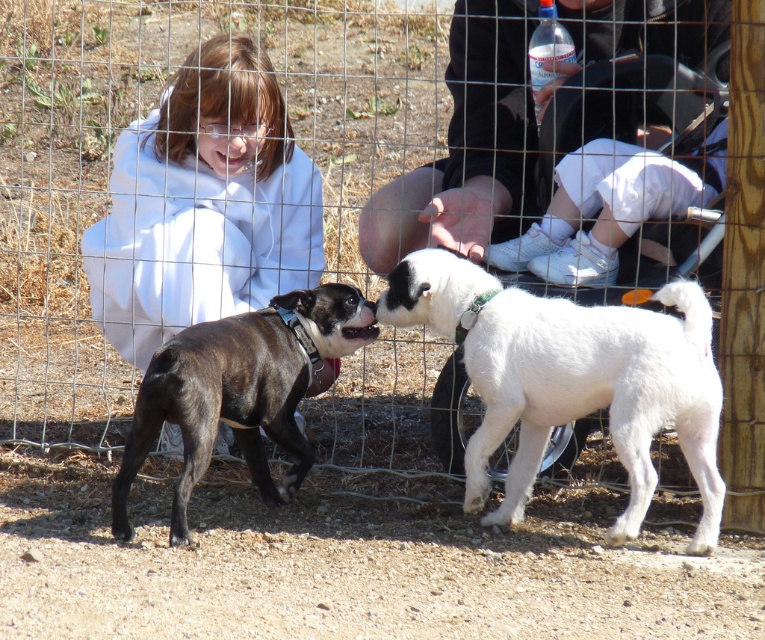
Is point (560, 109) positioned in front of point (106, 241)?

Yes, point (560, 109) is closer to viewer.

Which of these two, black fabric pants at lower center or white clothed child at left, stands shorter?

Standing shorter between the two is black fabric pants at lower center.

Is point (624, 221) positioned behind point (259, 106)?

No.

In order to click on black fabric pants at lower center in this screenshot , I will do `click(557, 141)`.

Which is more to the right, white clothed child at left or white fluffy dog at center?

white fluffy dog at center is more to the right.

Can you confirm if white clothed child at left is bigger than white fluffy dog at center?

Indeed, white clothed child at left has a larger size compared to white fluffy dog at center.

This screenshot has width=765, height=640. Find the location of `white clothed child at left`. white clothed child at left is located at coordinates (203, 204).

Is black fabric pants at lower center smaller than white fluffy dog at center?

Actually, black fabric pants at lower center might be larger than white fluffy dog at center.

In the scene shown: Which is more to the left, black fabric pants at lower center or white fluffy dog at center?

white fluffy dog at center

Which is in front, point (617, 164) or point (604, 380)?

Point (604, 380)

Find the location of a particular element. This screenshot has width=765, height=640. black fabric pants at lower center is located at coordinates (557, 141).